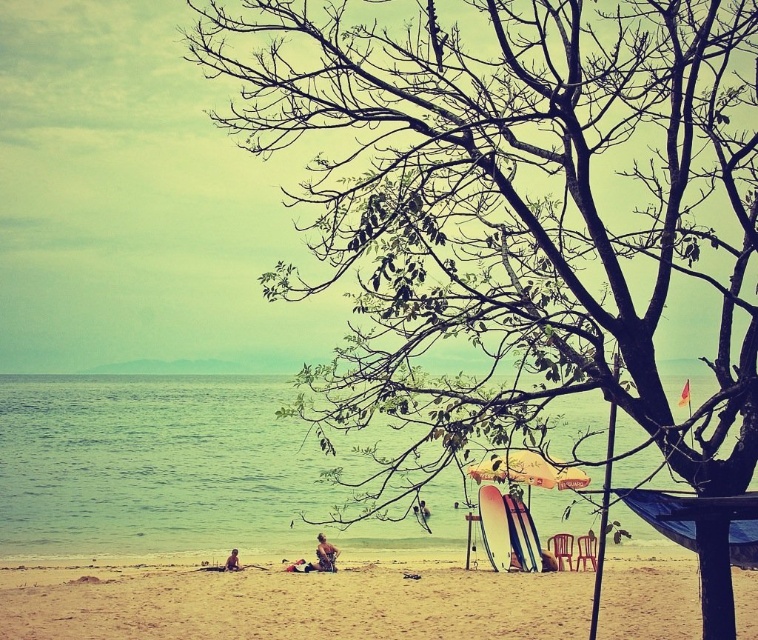
You are a photographer standing at the edge of the beach scene. You want to take a photo that includes both the green water at lower left and the tan skin person at lower left. Considering their heights, which object should be placed closer to the front of the frame to ensure both are fully visible?

The tan skin person at lower left should be placed closer to the front of the frame because the green water at lower left is taller. Positioning the person in front will allow both the person and the water to be fully visible without one blocking the other.

You are standing on the beach and see the wooden surfboard at lower center and the smooth skin person at lower center. Which object is positioned to the right of the other?

The wooden surfboard at lower center is to the right of the smooth skin person at lower center.

You are at the beach and want to place your brown leather bag at lower center under the yellow fabric umbrella at lower center. Do you think the umbrella will provide enough shade for the bag?

The yellow fabric umbrella at lower center is bigger than the brown leather bag at lower center, so yes, the umbrella will provide enough shade for the bag.